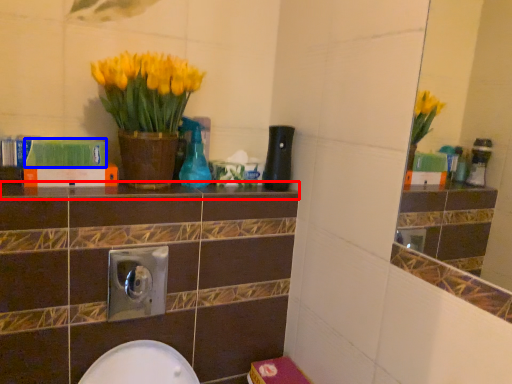
Question: Which object appears closest to the camera in this image, ledge (highlighted by a red box) or book (highlighted by a blue box)?

Choices:
 (A) ledge
 (B) book

Answer: (A)